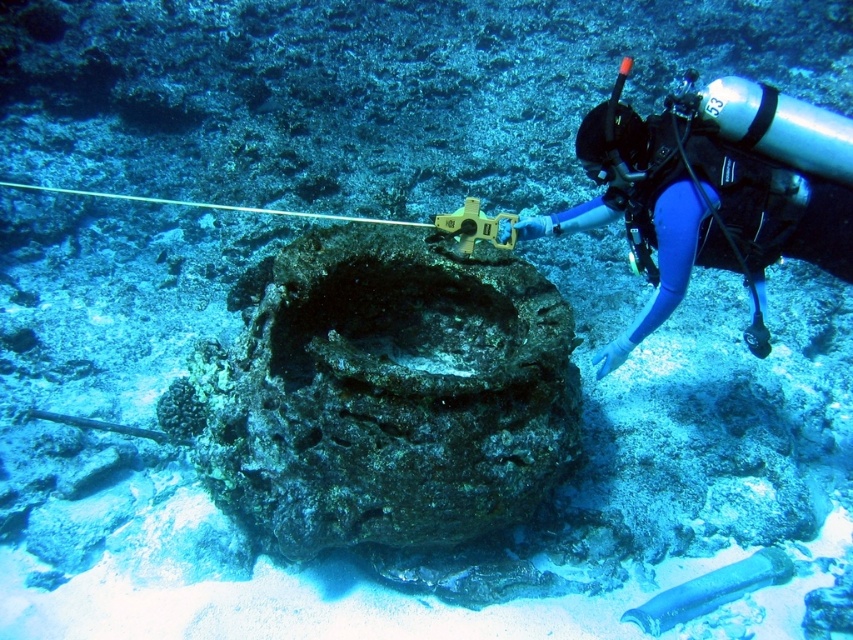
Question: Does rusty metallic rock at center appear under translucent blue glass pipe at lower center?

Choices:
 (A) yes
 (B) no

Answer: (B)

Question: Based on their relative distances, which object is farther from the translucent blue glass pipe at lower center?

Choices:
 (A) rusty metallic rock at center
 (B) blue neoprene wetsuit at center

Answer: (B)

Question: Which object is the closest to the rusty metallic rock at center?

Choices:
 (A) translucent blue glass pipe at lower center
 (B) blue neoprene wetsuit at center

Answer: (B)

Question: Which of the following is the closest to the observer?

Choices:
 (A) blue neoprene wetsuit at center
 (B) translucent blue glass pipe at lower center

Answer: (A)

Question: Does rusty metallic rock at center lie in front of translucent blue glass pipe at lower center?

Choices:
 (A) no
 (B) yes

Answer: (B)

Question: Considering the relative positions of rusty metallic rock at center and translucent blue glass pipe at lower center in the image provided, where is rusty metallic rock at center located with respect to translucent blue glass pipe at lower center?

Choices:
 (A) left
 (B) right

Answer: (A)